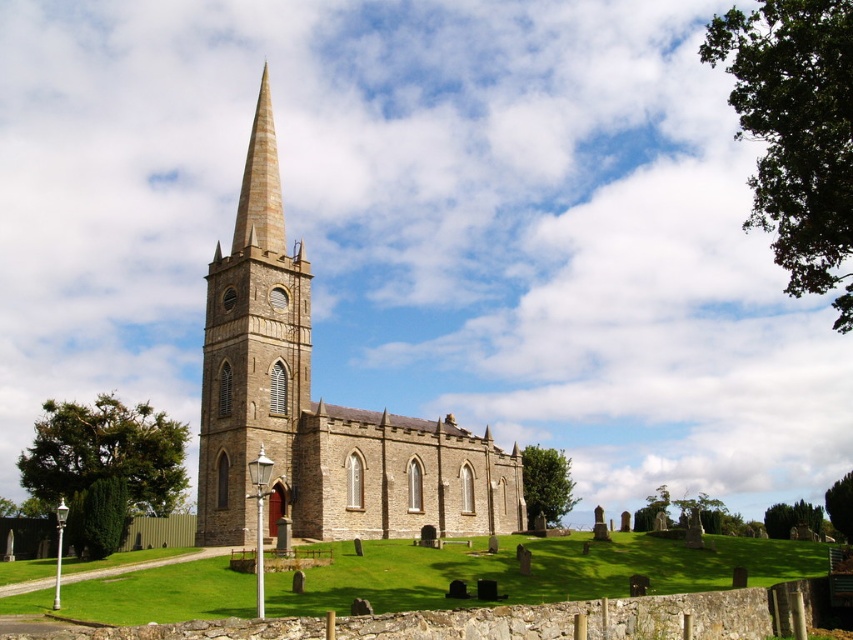
Is brown stone church at center wider than yellow striped stone spire at center?

Correct, the width of brown stone church at center exceeds that of yellow striped stone spire at center.

Does brown stone church at center have a lesser height compared to yellow striped stone spire at center?

Incorrect, brown stone church at center's height does not fall short of yellow striped stone spire at center's.

Is point (398, 433) positioned before point (258, 211)?

That is False.

You are a GUI agent. You are given a task and a screenshot of the screen. Output one action in this format:
    pyautogui.click(x=<x>, y=<y>)
    Task: Click on the brown stone church at center
    This screenshot has width=853, height=640.
    Given the screenshot: What is the action you would take?
    pyautogui.click(x=317, y=406)

Which of these two, brown stone steeple at center or yellow striped stone spire at center, stands taller?

With more height is brown stone steeple at center.

Who is more forward, (265, 388) or (248, 163)?

Positioned in front is point (265, 388).

Find the location of `brown stone steeple at center`. brown stone steeple at center is located at coordinates point(253,353).

What do you see at coordinates (317, 406) in the screenshot? Image resolution: width=853 pixels, height=640 pixels. I see `brown stone church at center` at bounding box center [317, 406].

Is brown stone church at center positioned at the back of brown stone steeple at center?

No, it is not.

Between point (451, 444) and point (241, 388), which one is positioned in front?

Point (241, 388) is more forward.

Where is `brown stone church at center`? brown stone church at center is located at coordinates (317, 406).